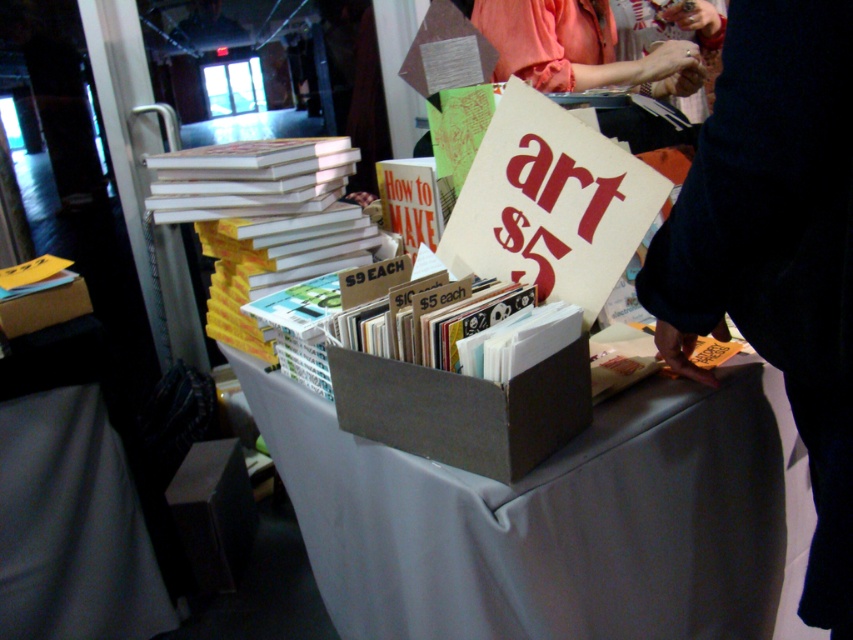
Question: Which of the following is the farthest from the observer?

Choices:
 (A) (834, 33)
 (B) (294, 237)

Answer: (B)

Question: Estimate the real-world distances between objects in this image. Which object is closer to the matte paper book at center?

Choices:
 (A) dark blue sweater at upper right
 (B) orange fabric hand at upper center
 (C) yellow paperbacks at center
 (D) gray fabric tablecloth at center

Answer: (A)

Question: Which object is positioned farthest from the matte paper book at center?

Choices:
 (A) yellow paperbacks at center
 (B) gray fabric tablecloth at center
 (C) orange fabric hand at upper center
 (D) dark blue sweater at upper right

Answer: (C)

Question: Can you confirm if dark blue sweater at upper right is wider than matte paper book at center?

Choices:
 (A) no
 (B) yes

Answer: (A)

Question: Is gray fabric tablecloth at center in front of matte paper book at center?

Choices:
 (A) no
 (B) yes

Answer: (A)

Question: Considering the relative positions of dark blue sweater at upper right and yellow paperbacks at center in the image provided, where is dark blue sweater at upper right located with respect to yellow paperbacks at center?

Choices:
 (A) left
 (B) right

Answer: (B)